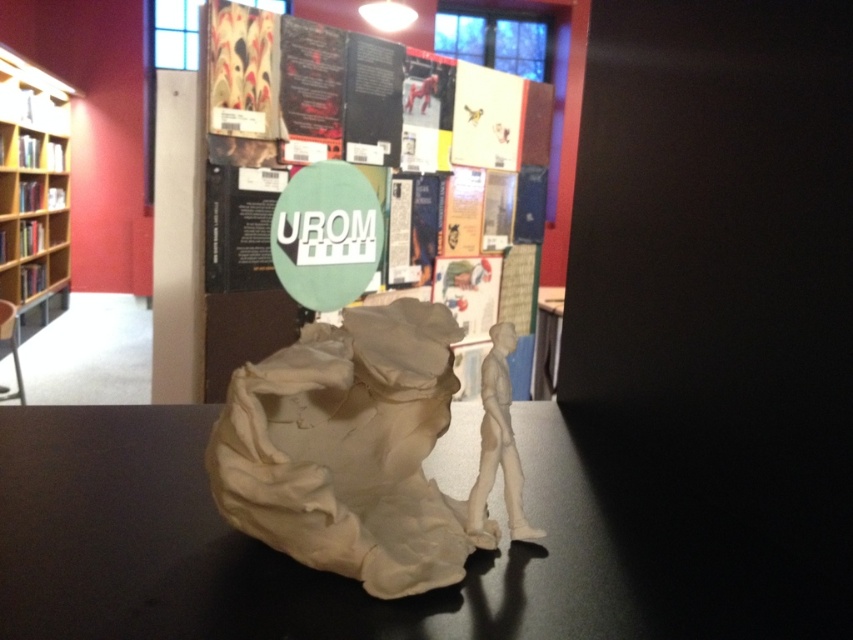
You are an art student who needs to place a new poster between the beige matte sculpture at center and the wooden bookshelf at left. Based on their positions, where should you place the poster?

The beige matte sculpture at center is located below the wooden bookshelf at left, so you should place the poster between them by positioning it above the beige matte sculpture at center and below the wooden bookshelf at left.

You are an art student who needs to determine the relative heights of two objects in the scene. Given the matte beige sculpture at center and the green matte sign at center, which one is shorter?

The matte beige sculpture at center is shorter than the green matte sign at center.